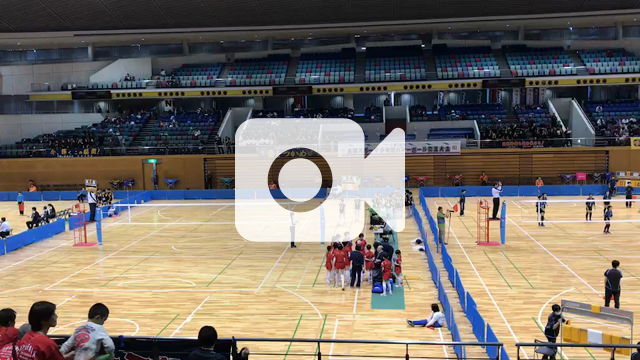
Locate an element on the screen. The height and width of the screenshot is (360, 640). hardwood floor is located at coordinates (134, 278).